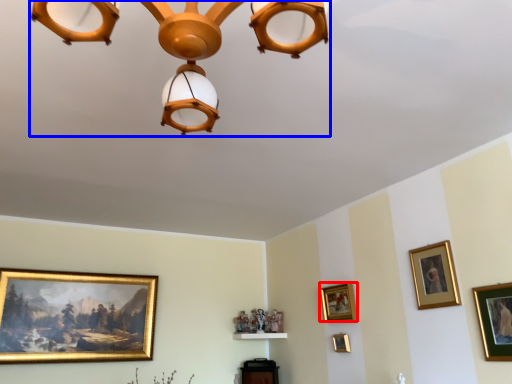
Question: Which object appears closest to the camera in this image, picture frame (highlighted by a red box) or lamp (highlighted by a blue box)?

Choices:
 (A) picture frame
 (B) lamp

Answer: (B)